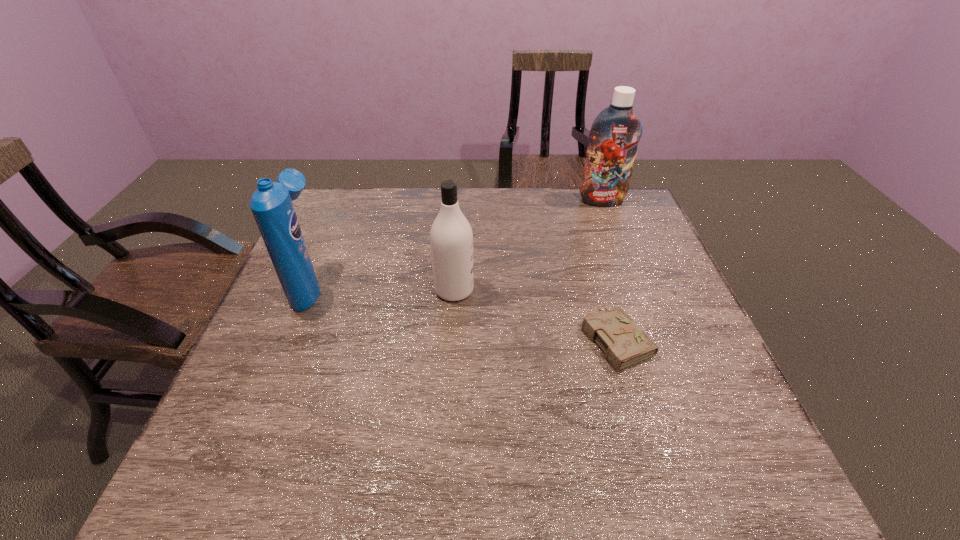
Identify the location of object positioned at the left edge. [x=271, y=203].

Where is `shampoo at the right edge`? The height and width of the screenshot is (540, 960). shampoo at the right edge is located at coordinates (614, 135).

Identify the location of diary present at the right edge. This screenshot has width=960, height=540. (625, 344).

Locate an element on the screen. The height and width of the screenshot is (540, 960). object that is positioned at the far right corner is located at coordinates (614, 135).

Find the location of a particular element. free region at the far edge of the desktop is located at coordinates (515, 215).

Find the location of a particular element. The width and height of the screenshot is (960, 540). vacant space at the left edge of the desktop is located at coordinates (269, 380).

Locate an element on the screen. This screenshot has width=960, height=540. vacant space at the right edge is located at coordinates (692, 320).

At what (x,y) coordinates should I click in order to perform the action: click on vacant space at the far left corner of the desktop. Please return your answer as a coordinate pair (x, y). Image resolution: width=960 pixels, height=540 pixels. Looking at the image, I should click on (353, 207).

Image resolution: width=960 pixels, height=540 pixels. In order to click on blank space at the near right corner of the desktop in this screenshot , I will do `click(687, 463)`.

This screenshot has height=540, width=960. I want to click on empty space between the farthest shampoo and the second shampoo from left to right, so click(x=528, y=245).